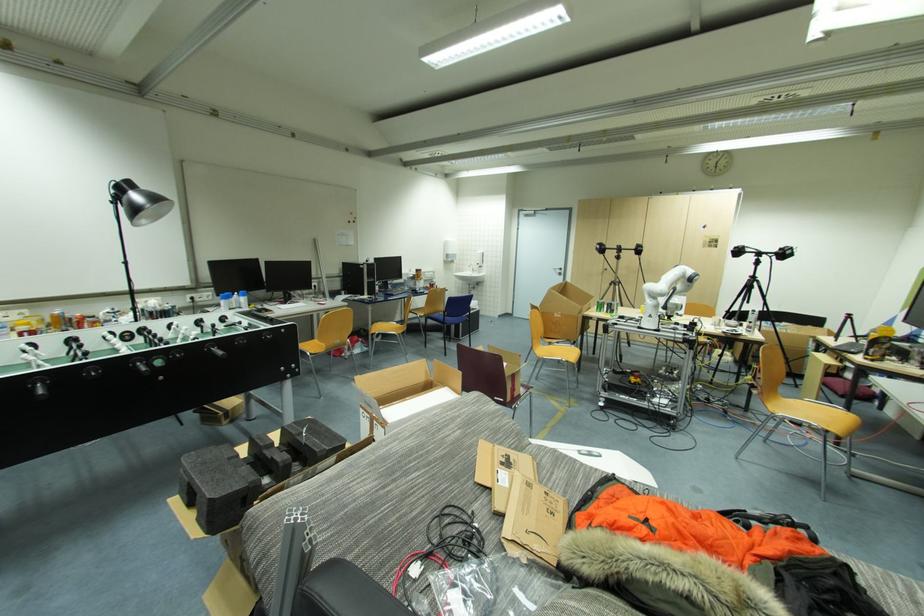
You are a GUI agent. You are given a task and a screenshot of the screen. Output one action in this format:
    pyautogui.click(x=<x>, y=<y>)
    Task: Click on the open cardboard box
    The width and height of the screenshot is (924, 616).
    Given the screenshot: What is the action you would take?
    pyautogui.click(x=369, y=402)